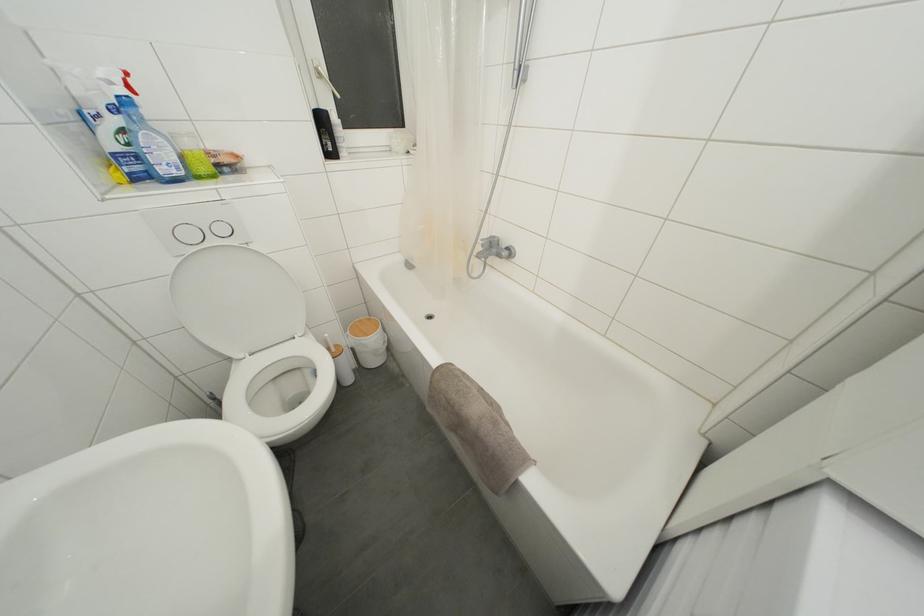
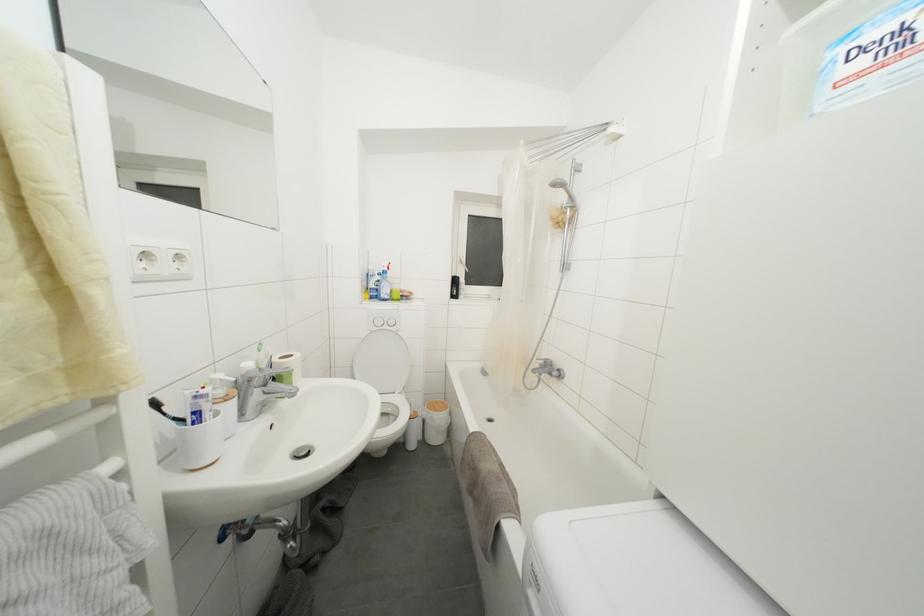
The point at (x=484, y=241) is marked in the first image. Where is the corresponding point in the second image?

(540, 362)